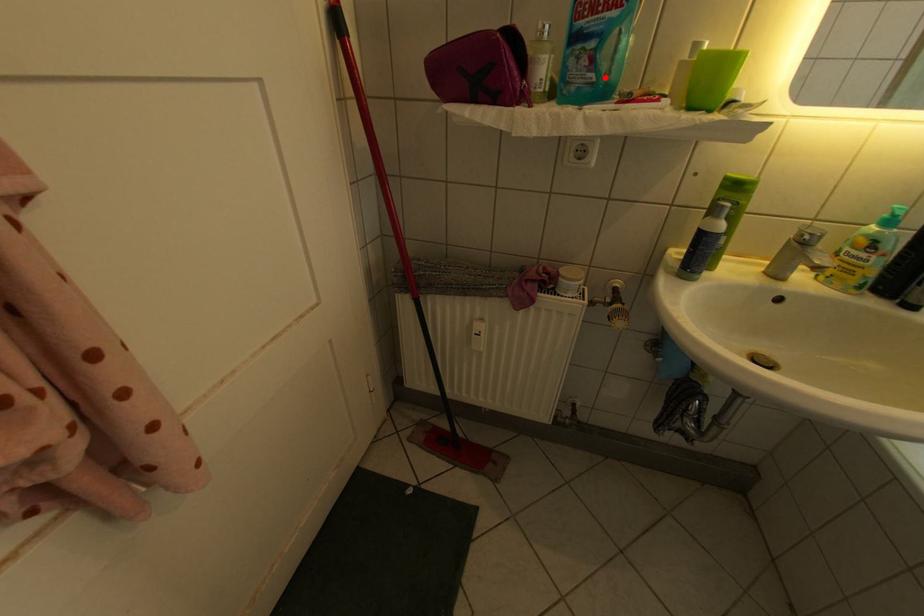
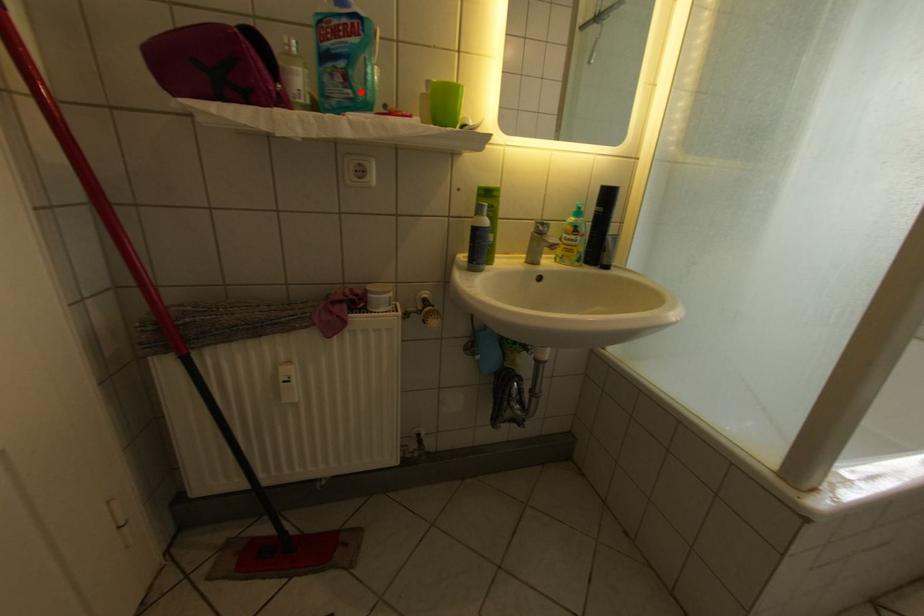
I am providing you with two images of the same scene from different viewpoints. A red point is marked on the first image and another point is marked on the second image. Does the point marked in image1 correspond to the same location as the one in image2?

Yes